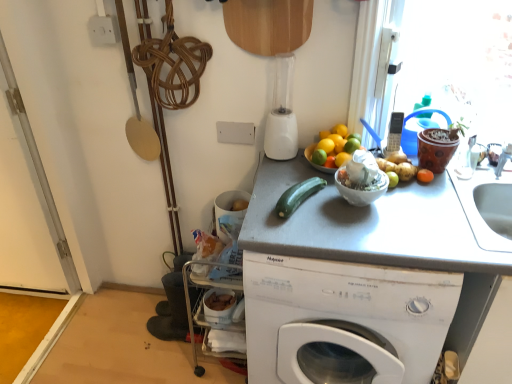
At what (x,y) coordinates should I click in order to perform the action: click on vacant location behind green smooth-textured zucchini at center. Please return your answer as a coordinate pair (x, y). The width and height of the screenshot is (512, 384). Looking at the image, I should click on (283, 173).